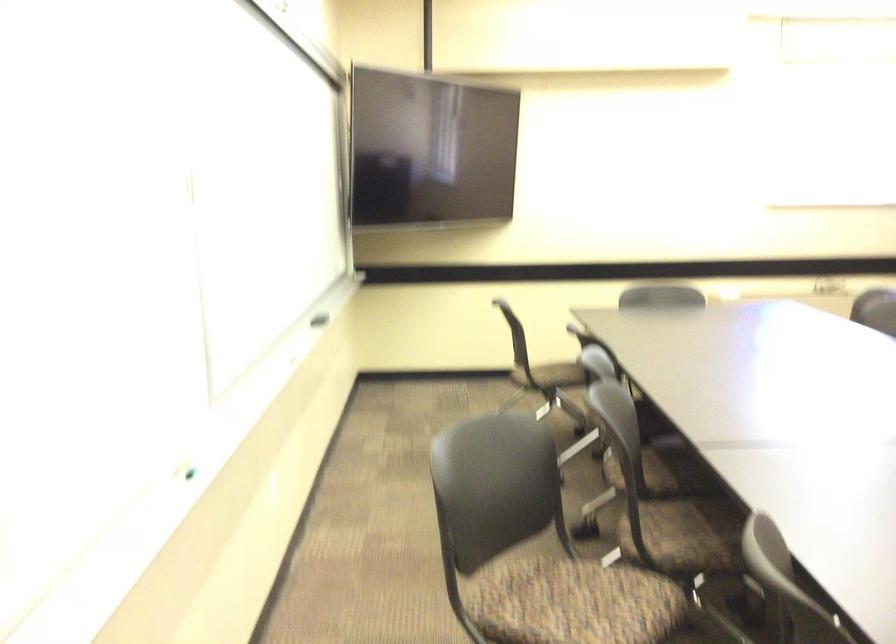
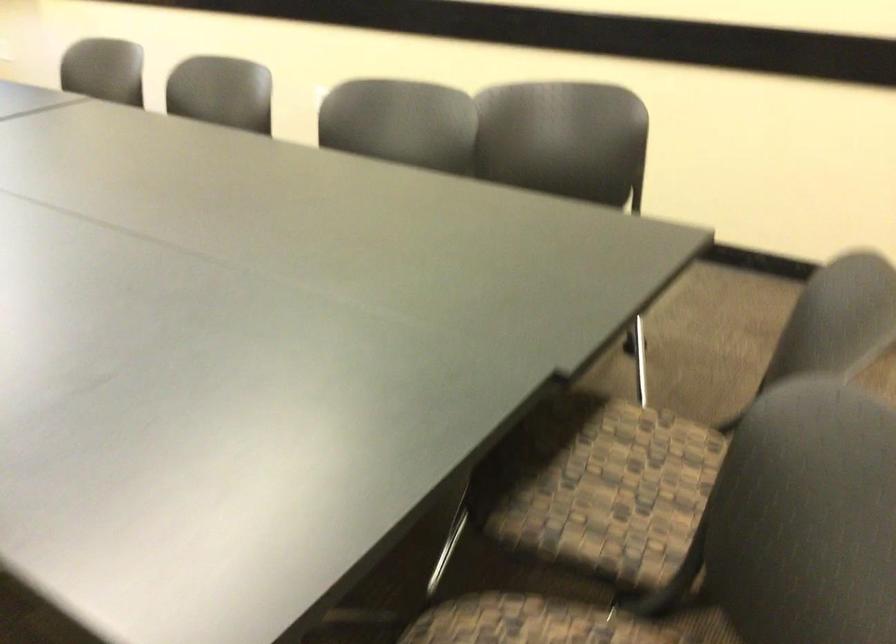
Based on the continuous images, in which direction is the camera rotating?

The rotation direction of the camera is right-down.